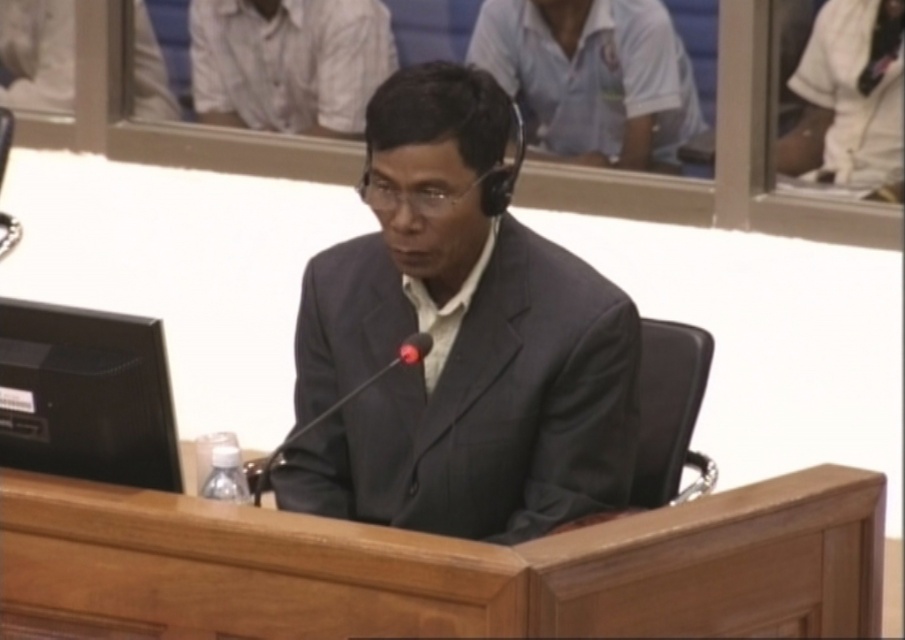
Question: Estimate the real-world distances between objects in this image. Which object is farther from the white matte shirt at upper left?

Choices:
 (A) wooden table at center
 (B) white matte shirt at upper center
 (C) matte black suit at center

Answer: (A)

Question: Considering the relative positions of wooden table at center and white matte shirt at upper center in the image provided, where is wooden table at center located with respect to white matte shirt at upper center?

Choices:
 (A) right
 (B) left

Answer: (B)

Question: Considering the real-world distances, which object is farthest from the white matte shirt at upper center?

Choices:
 (A) white matte shirt at upper left
 (B) matte black suit at center

Answer: (B)

Question: Among these objects, which one is farthest from the camera?

Choices:
 (A) white matte shirt at upper left
 (B) matte black suit at center

Answer: (A)

Question: Is matte black suit at center smaller than white matte shirt at upper left?

Choices:
 (A) yes
 (B) no

Answer: (B)

Question: Is matte black suit at center to the left of white matte shirt at upper center from the viewer's perspective?

Choices:
 (A) yes
 (B) no

Answer: (A)